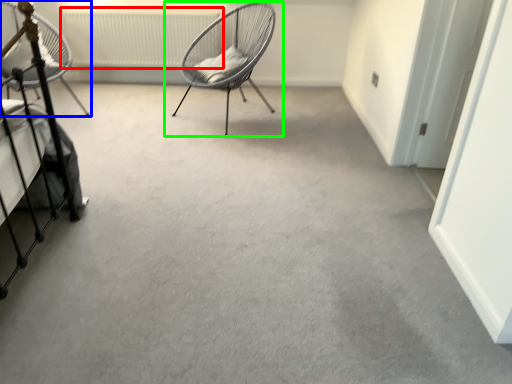
Question: Based on their relative distances, which object is farther from radiator (highlighted by a red box)? Choose from chair (highlighted by a blue box) and chair (highlighted by a green box).

Choices:
 (A) chair
 (B) chair

Answer: (A)